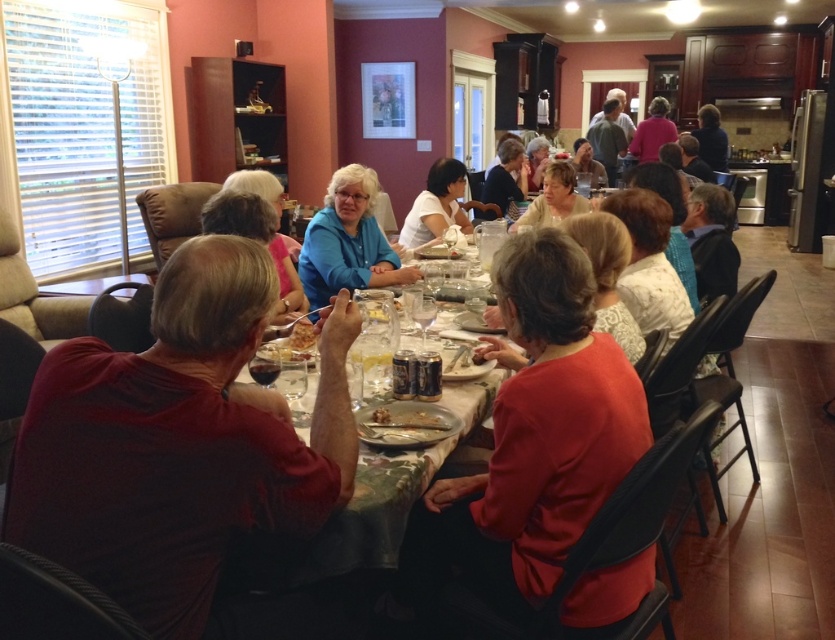
Question: Which object is closer to the camera taking this photo?

Choices:
 (A) white matte shirt at center
 (B) matte red shirt at center
 (C) matte blue shirt at center
 (D) smooth brown bread at center

Answer: (B)

Question: Is matte red shirt at center to the right of shiny silver fork at center from the viewer's perspective?

Choices:
 (A) yes
 (B) no

Answer: (A)

Question: Does green fabric table at center have a smaller size compared to white matte shirt at center?

Choices:
 (A) yes
 (B) no

Answer: (A)

Question: Does dark red shirt at left have a smaller size compared to matte red shirt at center?

Choices:
 (A) yes
 (B) no

Answer: (A)

Question: Which of the following is the closest to the observer?

Choices:
 (A) (311, 339)
 (B) (316, 308)

Answer: (A)

Question: Which point is closer to the camera taking this photo?

Choices:
 (A) (358, 227)
 (B) (565, 163)
 (C) (291, 346)
 (D) (459, 499)

Answer: (D)